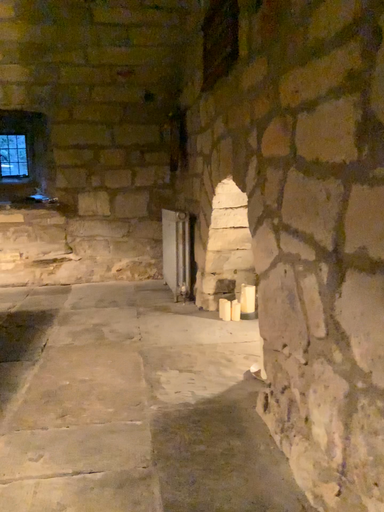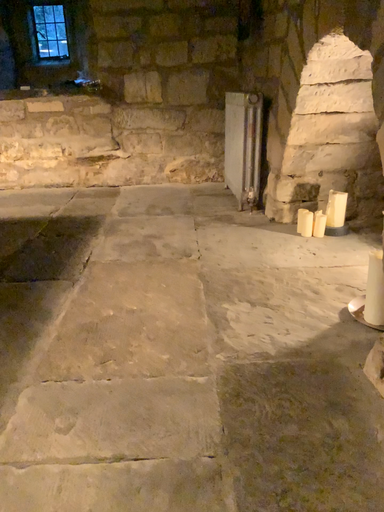
Question: Which way did the camera rotate in the video?

Choices:
 (A) rotated downward
 (B) rotated upward

Answer: (A)